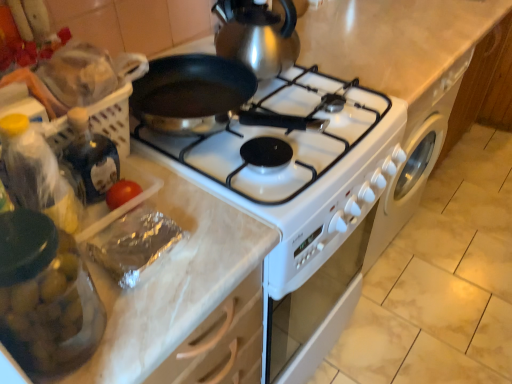
The width and height of the screenshot is (512, 384). Identify the location of vacant space to the right of transparent glass jar at left. (175, 302).